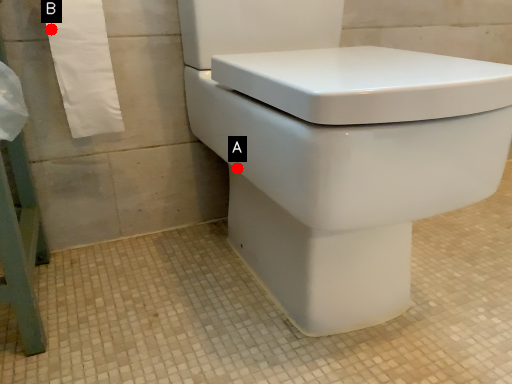
Question: Two points are circled on the image, labeled by A and B beside each circle. Which point is closer to the camera?

Choices:
 (A) A is closer
 (B) B is closer

Answer: (A)